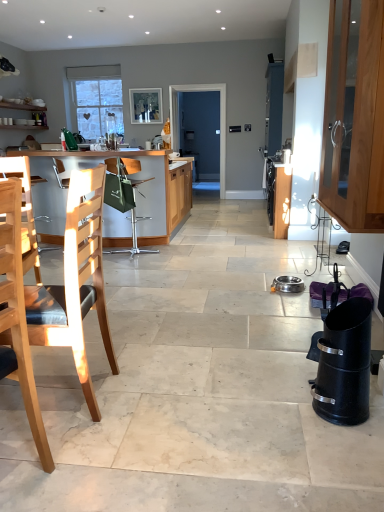
At what (x,y) coordinates should I click in order to perform the action: click on free space to the right of light wood chair at left, the second chair viewed from the back. Please return your answer as a coordinate pair (x, y). Looking at the image, I should click on (146, 394).